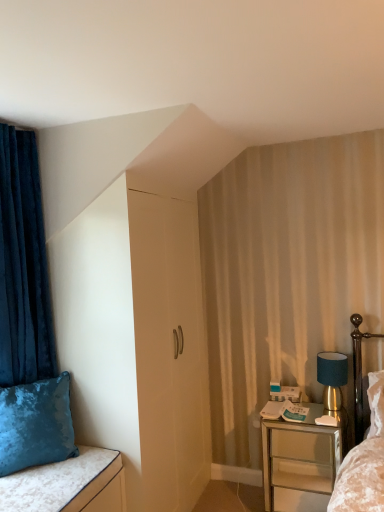
Where is `free space above velvet cushion at lower left (from a real-world perspective)`? free space above velvet cushion at lower left (from a real-world perspective) is located at coordinates (32, 478).